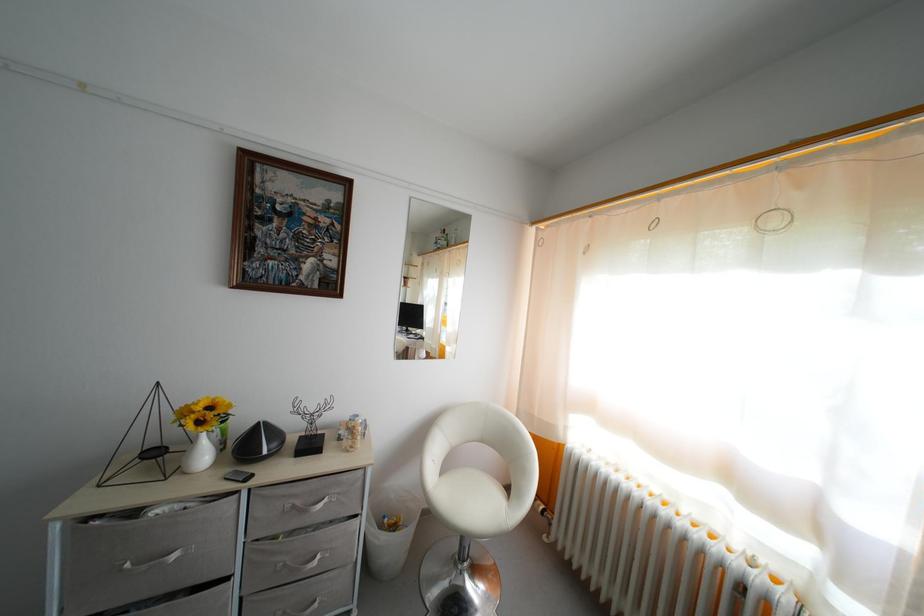
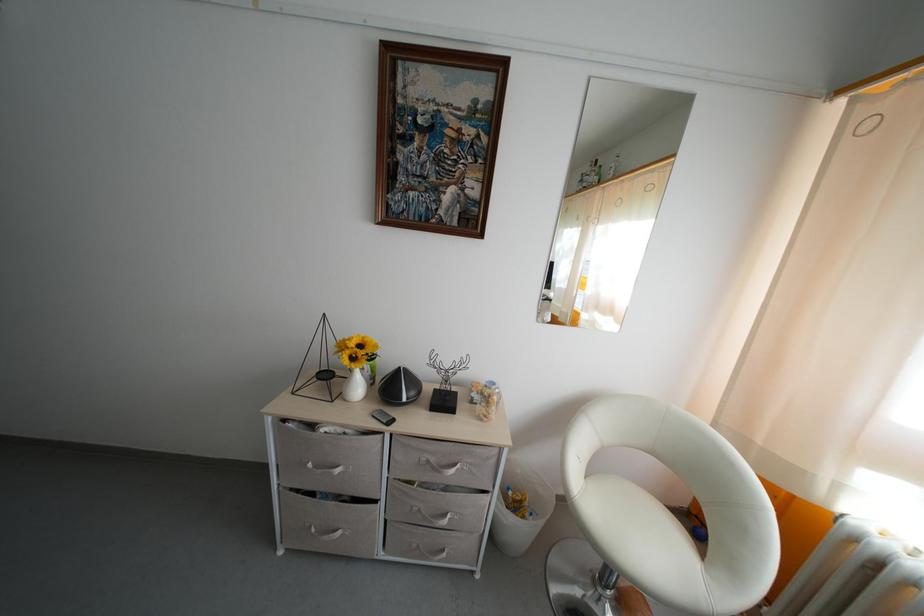
Where in the second image is the point corresponding to (x=207, y=436) from the first image?

(359, 371)